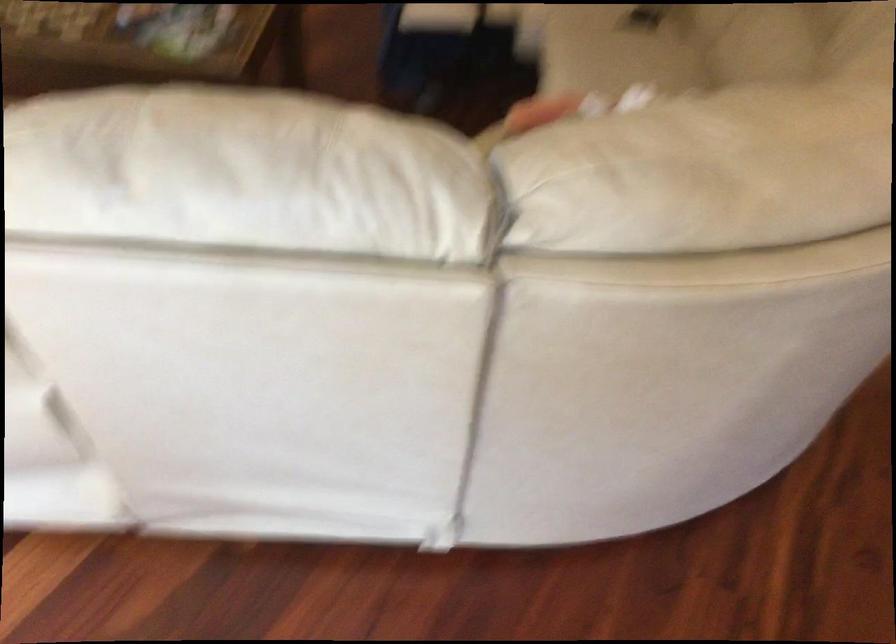
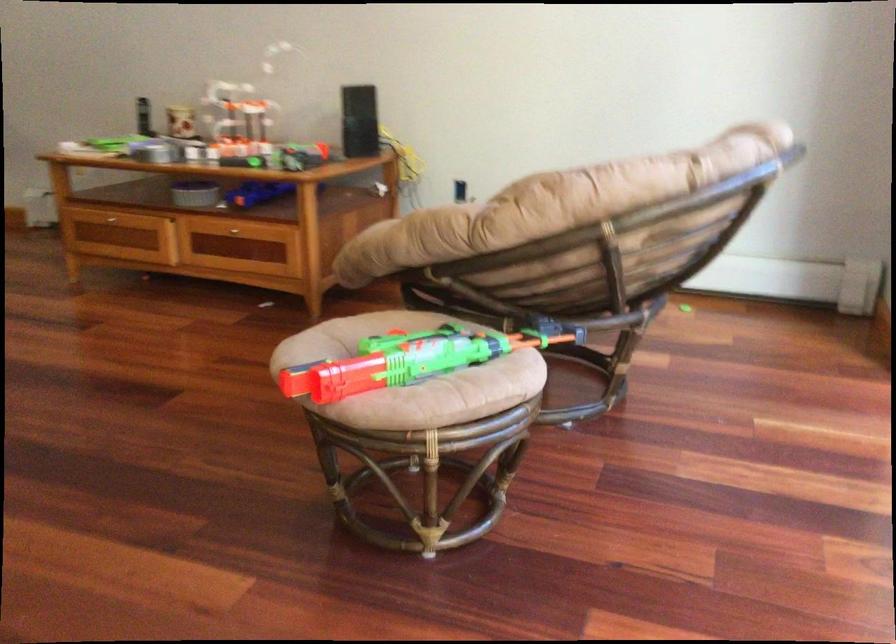
Based on the continuous images, in which direction is the camera rotating?

The camera's rotation is toward right-down.